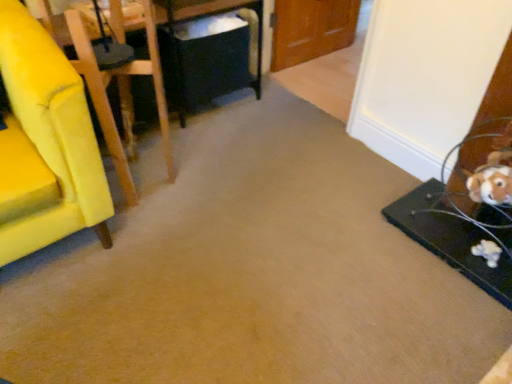
Question: Does yellow fabric chair at left lie behind black plastic table at center, which appears as the second table when viewed from the front?

Choices:
 (A) yes
 (B) no

Answer: (B)

Question: Is yellow fabric chair at left at the left side of black plastic table at center, which appears as the 1th table when viewed from the left?

Choices:
 (A) yes
 (B) no

Answer: (A)

Question: Is yellow fabric chair at left with black plastic table at center, arranged as the first table when viewed from the back?

Choices:
 (A) yes
 (B) no

Answer: (B)

Question: Can black plastic table at center, marked as the 2th table in a bottom-to-top arrangement, be found inside yellow fabric chair at left?

Choices:
 (A) no
 (B) yes

Answer: (A)

Question: From the image's perspective, is yellow fabric chair at left located beneath black plastic table at center, the second table when ordered from right to left?

Choices:
 (A) no
 (B) yes

Answer: (B)

Question: Is yellow fabric chair at left looking in the opposite direction of black plastic table at center, marked as the 2th table in a bottom-to-top arrangement?

Choices:
 (A) yes
 (B) no

Answer: (B)

Question: Considering the relative sizes of black plastic table at center, the second table when ordered from right to left, and yellow fabric chair at left in the image provided, is black plastic table at center, the second table when ordered from right to left, bigger than yellow fabric chair at left?

Choices:
 (A) yes
 (B) no

Answer: (B)

Question: Is black plastic table at center, arranged as the first table when viewed from the back, directly adjacent to yellow fabric chair at left?

Choices:
 (A) yes
 (B) no

Answer: (B)

Question: From the image's perspective, is black plastic table at center, arranged as the first table when viewed from the back, under yellow fabric chair at left?

Choices:
 (A) no
 (B) yes

Answer: (A)

Question: Is black plastic table at center, marked as the 2th table in a bottom-to-top arrangement, taller than yellow fabric chair at left?

Choices:
 (A) yes
 (B) no

Answer: (B)

Question: Does black plastic table at center, marked as the 2th table in a bottom-to-top arrangement, appear on the left side of yellow fabric chair at left?

Choices:
 (A) no
 (B) yes

Answer: (A)

Question: Would you say black plastic table at center, which ranks as the first table in top-to-bottom order, is outside yellow fabric chair at left?

Choices:
 (A) yes
 (B) no

Answer: (A)

Question: Is black plastic table at center, arranged as the first table when viewed from the back, not near black matte table at right, arranged as the second table when viewed from the top?

Choices:
 (A) no
 (B) yes

Answer: (B)